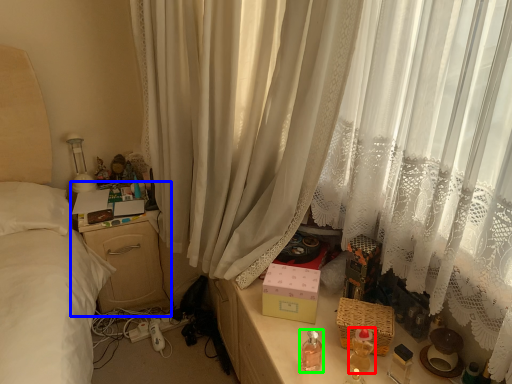
Question: Based on their relative distances, which object is farther from baby bottle (highlighted by a red box)? Choose from nightstand (highlighted by a blue box) and baby bottle (highlighted by a green box).

Choices:
 (A) nightstand
 (B) baby bottle

Answer: (A)